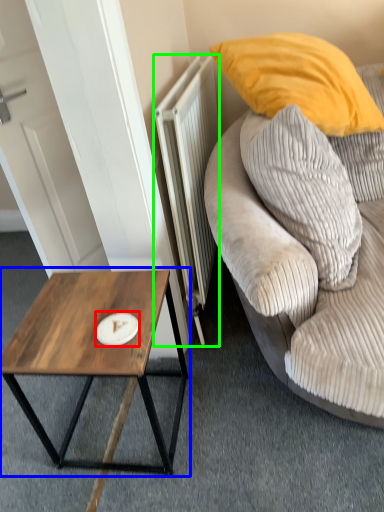
Question: Based on their relative distances, which object is farther from plate (highlighted by a red box)? Choose from coffee table (highlighted by a blue box) and radiator (highlighted by a green box).

Choices:
 (A) coffee table
 (B) radiator

Answer: (B)